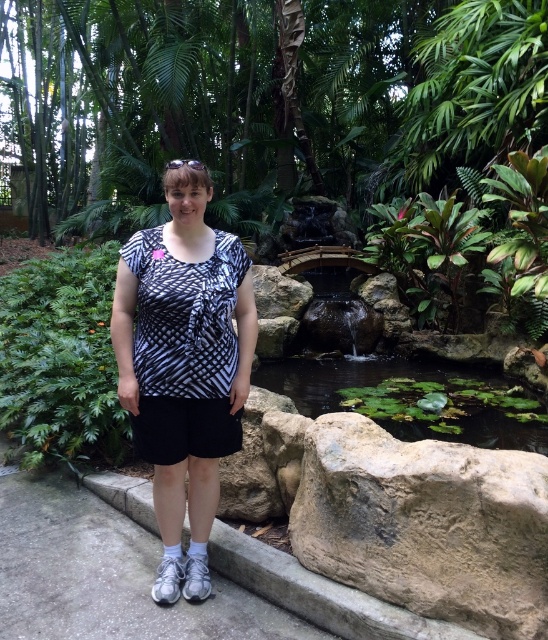
Question: Which point is farther to the camera?

Choices:
 (A) (248, 428)
 (B) (156, 419)
 (C) (397, 390)
 (D) (48, 305)

Answer: (C)

Question: Considering the relative positions of green leafy plant at lower right and black cotton shorts at center in the image provided, where is green leafy plant at lower right located with respect to black cotton shorts at center?

Choices:
 (A) left
 (B) right

Answer: (B)

Question: Considering the relative positions of green leafy plant at center and black cotton shorts at center in the image provided, where is green leafy plant at center located with respect to black cotton shorts at center?

Choices:
 (A) left
 (B) right

Answer: (A)

Question: Which of the following is the closest to the observer?

Choices:
 (A) (141, 419)
 (B) (487, 378)
 (C) (247, 470)
 (D) (501, 515)

Answer: (D)

Question: Can you confirm if brown rough rock at lower right is bigger than brown rough rock at center?

Choices:
 (A) yes
 (B) no

Answer: (A)

Question: Considering the real-world distances, which object is closest to the green leafy pond at center?

Choices:
 (A) printed cotton shirt at center
 (B) brown rough rock at lower right

Answer: (B)